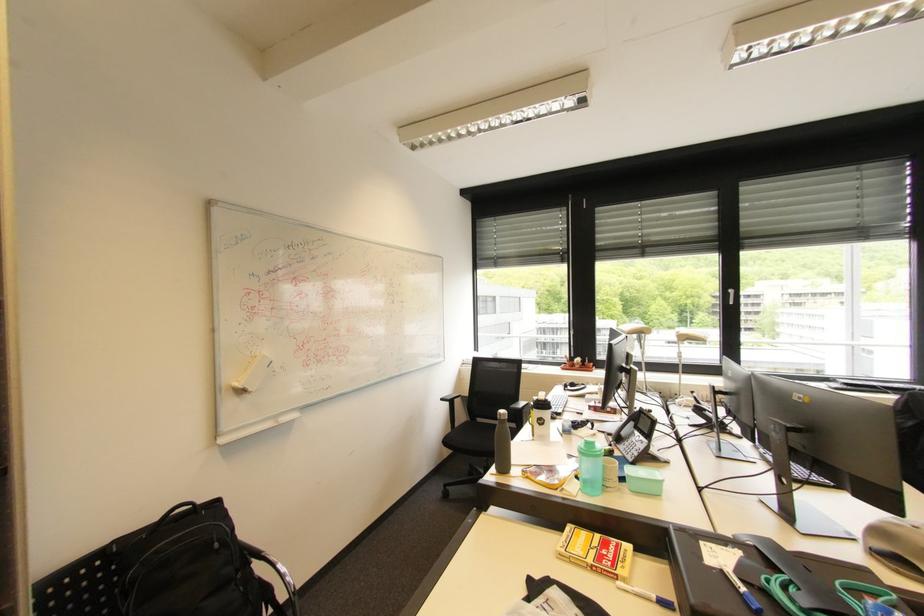
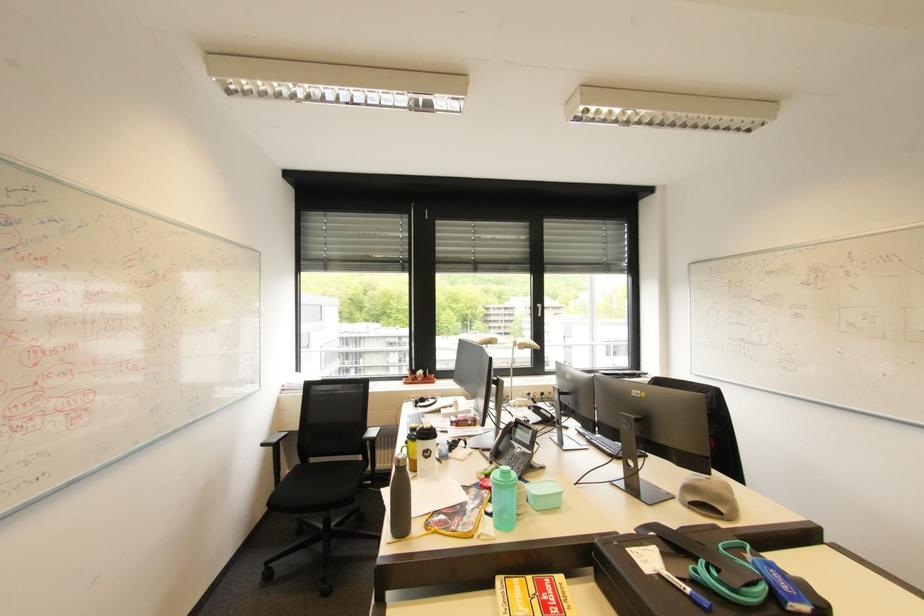
The point at (601, 448) is marked in the first image. Where is the corresponding point in the second image?

(517, 477)